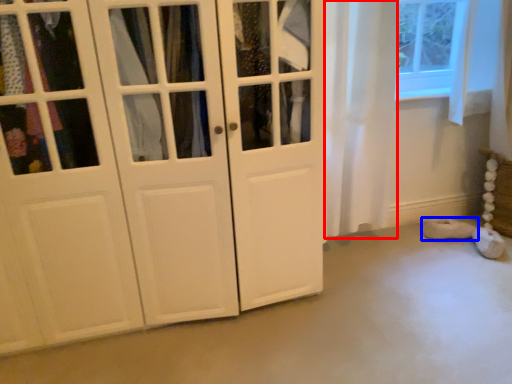
Question: Which object is further to the camera taking this photo, curtain (highlighted by a red box) or footwear (highlighted by a blue box)?

Choices:
 (A) curtain
 (B) footwear

Answer: (B)